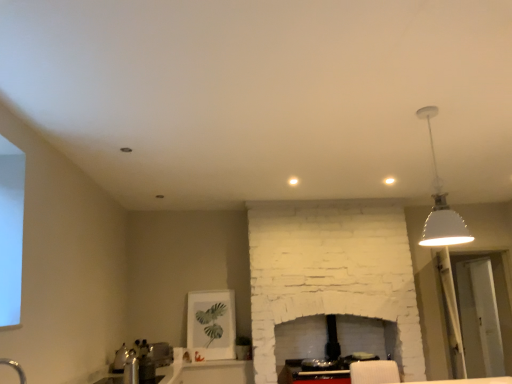
Question: From a real-world perspective, is silver metallic faucet at lower left on top of white matte lampshade at upper right?

Choices:
 (A) no
 (B) yes

Answer: (A)

Question: Is white matte lampshade at upper right a part of silver metallic faucet at lower left?

Choices:
 (A) yes
 (B) no

Answer: (B)

Question: Is silver metallic faucet at lower left closer to camera compared to white matte lampshade at upper right?

Choices:
 (A) no
 (B) yes

Answer: (A)

Question: Is silver metallic faucet at lower left not close to white matte lampshade at upper right?

Choices:
 (A) yes
 (B) no

Answer: (A)

Question: From a real-world perspective, is silver metallic faucet at lower left below white matte lampshade at upper right?

Choices:
 (A) yes
 (B) no

Answer: (A)

Question: Is white matte lampshade at upper right taller or shorter than silver metallic faucet at lower left?

Choices:
 (A) short
 (B) tall

Answer: (B)

Question: From a real-world perspective, is white matte lampshade at upper right physically located above or below silver metallic faucet at lower left?

Choices:
 (A) below
 (B) above

Answer: (B)

Question: Relative to silver metallic faucet at lower left, is white matte lampshade at upper right in front or behind?

Choices:
 (A) front
 (B) behind

Answer: (A)

Question: Is white matte lampshade at upper right situated inside silver metallic faucet at lower left or outside?

Choices:
 (A) outside
 (B) inside

Answer: (A)

Question: From a real-world perspective, is satin silver toaster at lower left physically located above or below white matte lampshade at upper right?

Choices:
 (A) above
 (B) below

Answer: (B)

Question: Is satin silver toaster at lower left in front of or behind white matte lampshade at upper right in the image?

Choices:
 (A) front
 (B) behind

Answer: (B)

Question: Considering the relative positions of satin silver toaster at lower left and white matte lampshade at upper right in the image provided, is satin silver toaster at lower left to the left or to the right of white matte lampshade at upper right?

Choices:
 (A) right
 (B) left

Answer: (B)

Question: Is point (152, 347) closer or farther from the camera than point (442, 198)?

Choices:
 (A) closer
 (B) farther

Answer: (B)

Question: In terms of size, does white matte lampshade at upper right appear bigger or smaller than transparent glass door at right?

Choices:
 (A) big
 (B) small

Answer: (B)

Question: Which is correct: white matte lampshade at upper right is inside transparent glass door at right, or outside of it?

Choices:
 (A) outside
 (B) inside

Answer: (A)